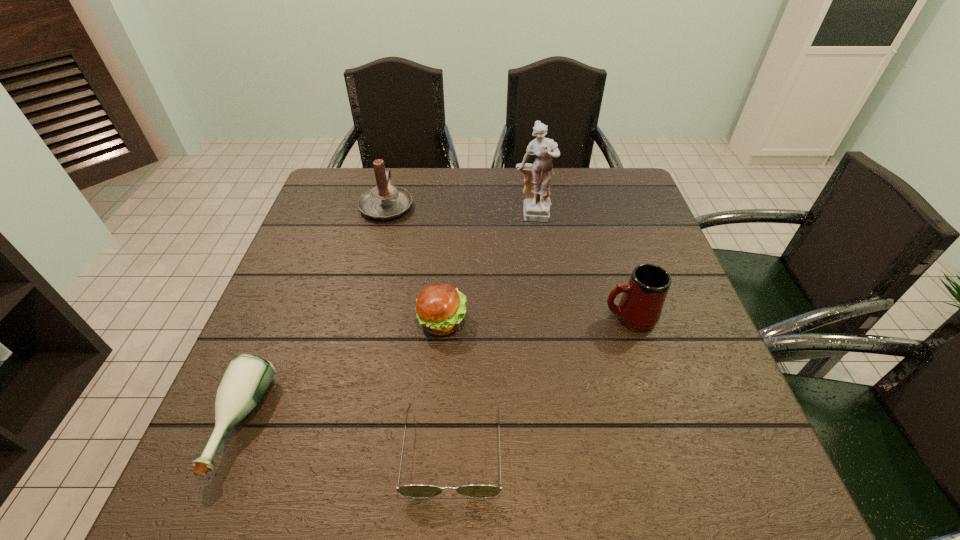
Locate an element on the screen. empty space that is in between the second object from left to right and the second object from right to left is located at coordinates (459, 211).

The height and width of the screenshot is (540, 960). In order to click on vacant area that lies between the fifth shortest object and the fourth shortest object in this screenshot , I will do `click(508, 261)`.

Locate an element on the screen. object that is the fifth nearest to the hamburger is located at coordinates (640, 307).

This screenshot has width=960, height=540. I want to click on object that can be found as the closest to the mug, so click(x=536, y=206).

You are a GUI agent. You are given a task and a screenshot of the screen. Output one action in this format:
    pyautogui.click(x=<x>, y=<y>)
    Task: Click on the free space in the image that satisfies the following two spatial constraints: 1. on the back side of the hamburger; 2. on the left side of the bottle
    
    Given the screenshot: What is the action you would take?
    pyautogui.click(x=283, y=321)

The width and height of the screenshot is (960, 540). In order to click on vacant space that satisfies the following two spatial constraints: 1. on the back side of the hamburger; 2. on the right side of the leftmost object in this screenshot , I will do `click(283, 321)`.